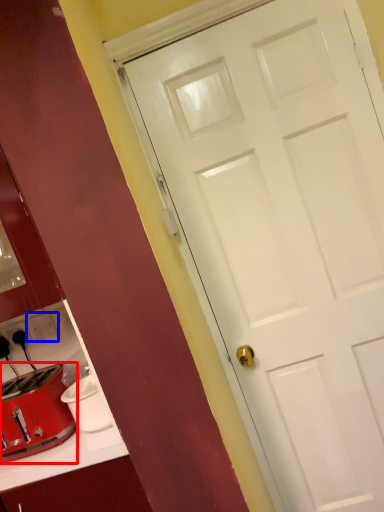
Question: Which object is closer to the camera taking this photo, toaster (highlighted by a red box) or electric outlet (highlighted by a blue box)?

Choices:
 (A) toaster
 (B) electric outlet

Answer: (A)